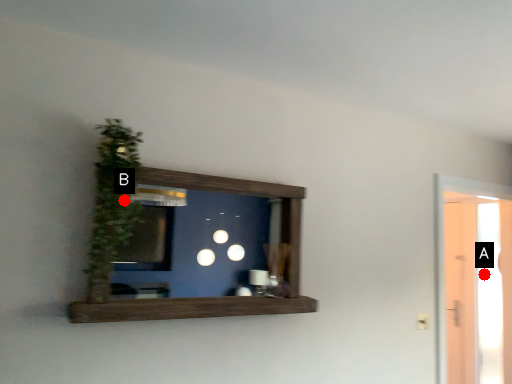
Question: Two points are circled on the image, labeled by A and B beside each circle. Which point is closer to the camera taking this photo?

Choices:
 (A) A is closer
 (B) B is closer

Answer: (B)